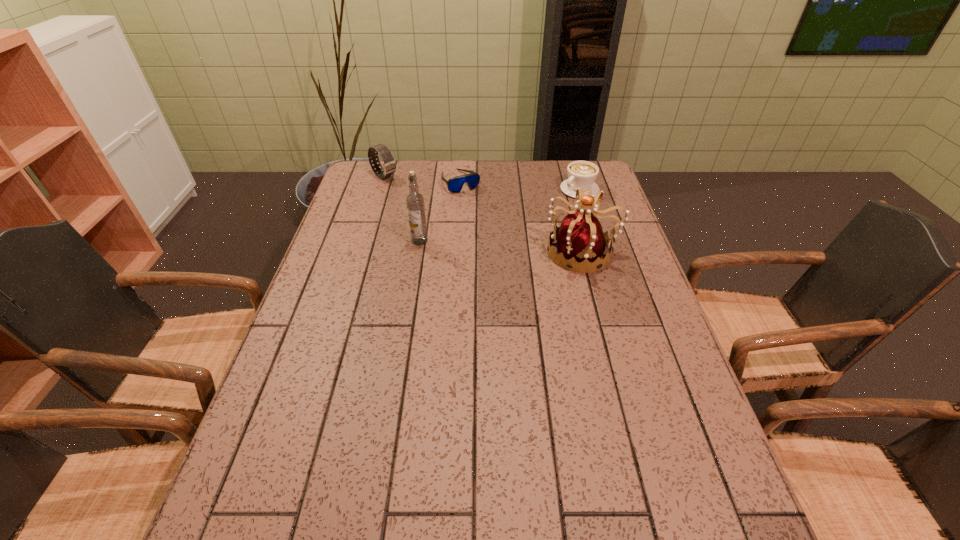
The width and height of the screenshot is (960, 540). I want to click on vacant area that lies between the cappuccino and the sunglasses, so click(x=520, y=185).

This screenshot has height=540, width=960. What are the coordinates of `free space between the tiara and the third shortest object` in the screenshot? It's located at (483, 214).

Where is `free space that is in between the leftmost object and the fourth object from right to left`? free space that is in between the leftmost object and the fourth object from right to left is located at coordinates [x=402, y=208].

Where is `vacant point located between the leftmost object and the cappuccino`? This screenshot has height=540, width=960. vacant point located between the leftmost object and the cappuccino is located at coordinates (482, 183).

This screenshot has height=540, width=960. Find the location of `unoccupied position between the second shortest object and the third object from left to right`. unoccupied position between the second shortest object and the third object from left to right is located at coordinates (520, 185).

Point out which object is positioned as the third nearest to the third shortest object. Please provide its 2D coordinates. Your answer should be formatted as a tuple, i.e. [(x, y)], where the tuple contains the x and y coordinates of a point satisfying the conditions above.

[(581, 240)]

At what (x,y) coordinates should I click in order to perform the action: click on object that is the fourth nearest to the tiara. Please return your answer as a coordinate pair (x, y). This screenshot has width=960, height=540. Looking at the image, I should click on (389, 165).